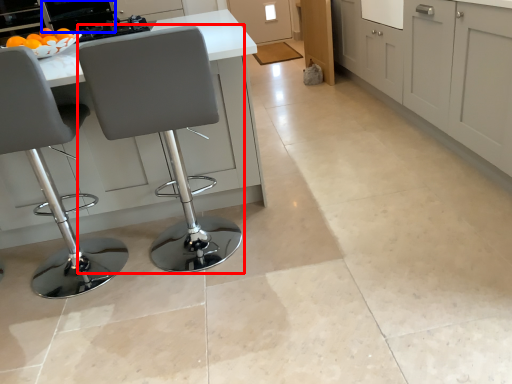
Question: Which object is further to the camera taking this photo, chair (highlighted by a red box) or appliance (highlighted by a blue box)?

Choices:
 (A) chair
 (B) appliance

Answer: (B)